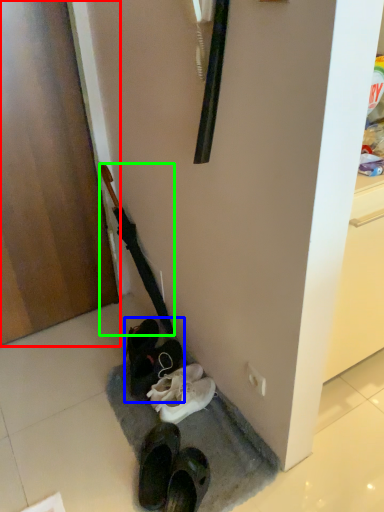
Question: Which object is positioned closest to door (highlighted by a red box)? Select from footwear (highlighted by a blue box) and umbrella (highlighted by a green box).

Choices:
 (A) footwear
 (B) umbrella

Answer: (B)